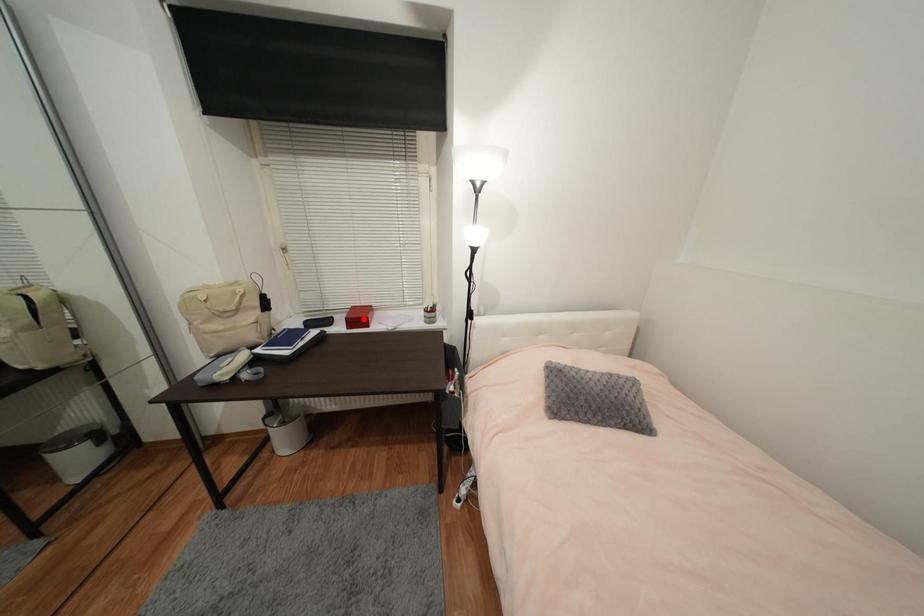
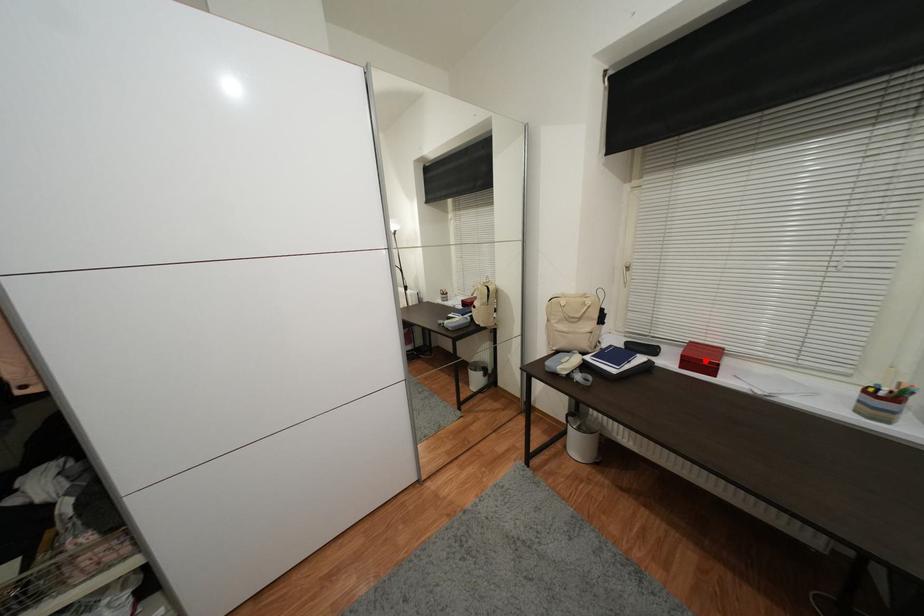
I am providing you with two images of the same scene from different viewpoints. A red point is marked on the first image and another point is marked on the second image. Are the points marked in image1 and image2 representing the same 3D position?

Yes